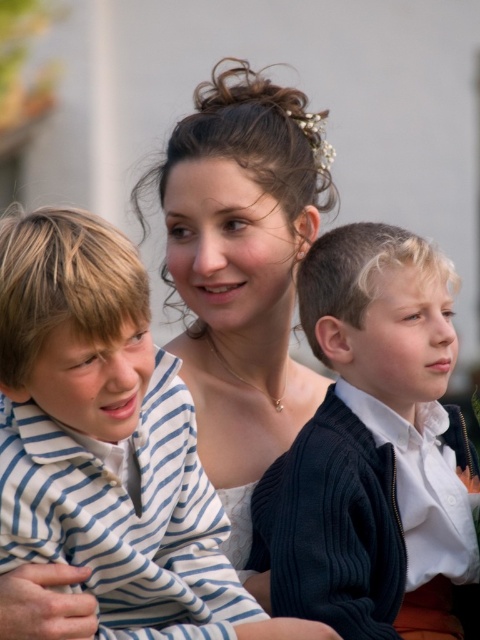
Can you confirm if dark blue sweater at center is positioned above white striped shirt at left?

No, dark blue sweater at center is not above white striped shirt at left.

Can you confirm if dark blue sweater at center is bigger than white striped shirt at left?

Correct, dark blue sweater at center is larger in size than white striped shirt at left.

Is point (368, 525) farther from viewer compared to point (48, 220)?

Yes, point (368, 525) is farther from viewer.

This screenshot has width=480, height=640. In order to click on dark blue sweater at center in this screenshot , I will do `click(373, 448)`.